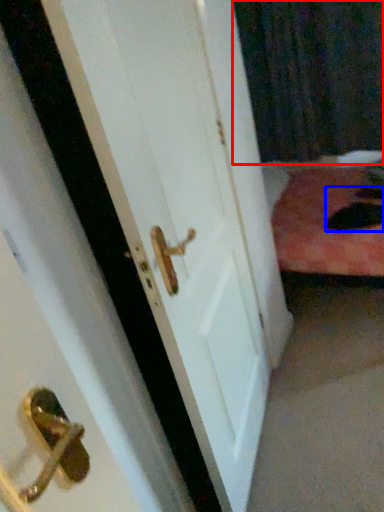
Question: Which point is closer to the camera, curtain (highlighted by a red box) or cat (highlighted by a blue box)?

Choices:
 (A) curtain
 (B) cat

Answer: (B)